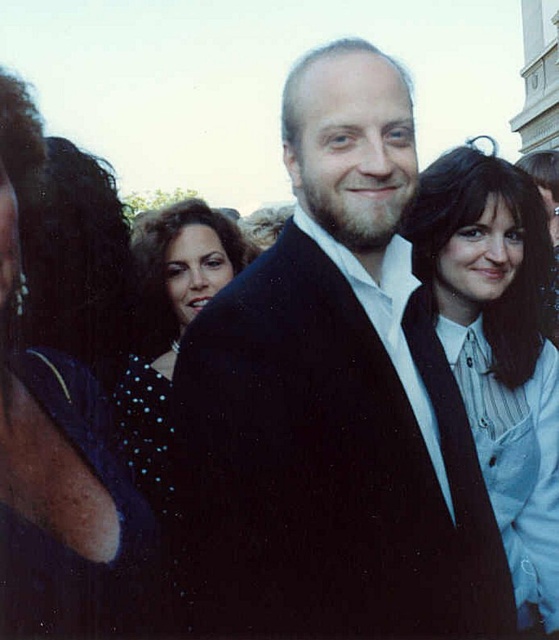
Which is below, black matte suit at center or light blue shirt at center?

light blue shirt at center

Who is positioned more to the left, black matte suit at center or light blue shirt at center?

black matte suit at center is more to the left.

Does point (324, 522) lie in front of point (416, 202)?

That is True.

This screenshot has height=640, width=559. Identify the location of black matte suit at center. (337, 396).

Which is more to the right, black matte suit at center or dark blue dotted dress at left?

black matte suit at center is more to the right.

Is the position of black matte suit at center less distant than that of dark blue dotted dress at left?

No, it is behind dark blue dotted dress at left.

Find the location of a particular element. This screenshot has width=559, height=640. black matte suit at center is located at coordinates (337, 396).

What do you see at coordinates (337, 396) in the screenshot? I see `black matte suit at center` at bounding box center [337, 396].

Who is shorter, black matte suit at center or sparkly blue dress at center?

With less height is sparkly blue dress at center.

Describe the element at coordinates (337, 396) in the screenshot. I see `black matte suit at center` at that location.

At what (x,y) coordinates should I click in order to perform the action: click on black matte suit at center. Please return your answer as a coordinate pair (x, y). This screenshot has width=559, height=640. Looking at the image, I should click on (337, 396).